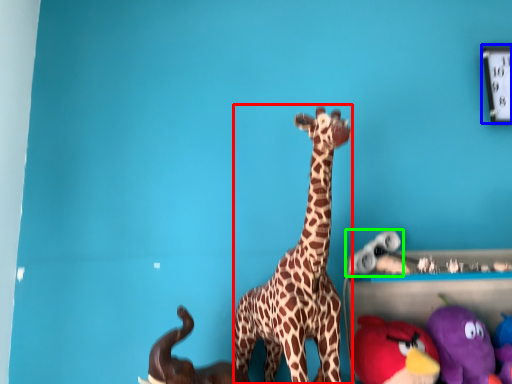
Question: Estimate the real-world distances between objects in this image. Which object is farther from giraffe (highlighted by a red box), clock (highlighted by a blue box) or toy (highlighted by a green box)?

Choices:
 (A) clock
 (B) toy

Answer: (A)